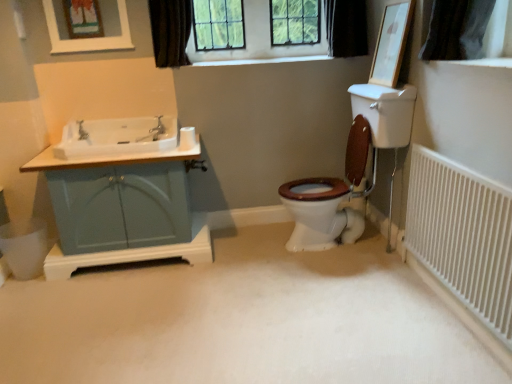
Question: Is clear glass window at upper center at the right side of white matte toilet paper at upper center?

Choices:
 (A) yes
 (B) no

Answer: (A)

Question: Can you confirm if clear glass window at upper center is bigger than white matte toilet paper at upper center?

Choices:
 (A) yes
 (B) no

Answer: (A)

Question: From the image's perspective, is clear glass window at upper center under white matte toilet paper at upper center?

Choices:
 (A) no
 (B) yes

Answer: (A)

Question: Can you confirm if clear glass window at upper center is wider than white matte toilet paper at upper center?

Choices:
 (A) yes
 (B) no

Answer: (A)

Question: From a real-world perspective, is clear glass window at upper center beneath white matte toilet paper at upper center?

Choices:
 (A) yes
 (B) no

Answer: (B)

Question: Does clear glass window at upper center appear on the left side of white matte toilet paper at upper center?

Choices:
 (A) no
 (B) yes

Answer: (A)

Question: Is the depth of white matte carpet at center less than that of wooden picture frame at upper right, which ranks as the first picture frame in right-to-left order?

Choices:
 (A) yes
 (B) no

Answer: (A)

Question: Does white matte carpet at center have a lesser width compared to wooden picture frame at upper right, which ranks as the first picture frame in right-to-left order?

Choices:
 (A) no
 (B) yes

Answer: (A)

Question: Is white matte carpet at center at the right side of wooden picture frame at upper right, which ranks as the first picture frame in right-to-left order?

Choices:
 (A) no
 (B) yes

Answer: (A)

Question: Is white matte carpet at center further to the viewer compared to wooden picture frame at upper right, which is counted as the second picture frame, starting from the left?

Choices:
 (A) no
 (B) yes

Answer: (A)

Question: Can you see white matte carpet at center touching wooden picture frame at upper right, which ranks as the first picture frame in right-to-left order?

Choices:
 (A) yes
 (B) no

Answer: (B)

Question: Is white matte carpet at center wider than wooden picture frame at upper right, which ranks as the first picture frame in right-to-left order?

Choices:
 (A) yes
 (B) no

Answer: (A)

Question: From the image's perspective, is brushed metal faucet at left over black fabric curtain at upper center, the 2th curtain in the left-to-right sequence?

Choices:
 (A) yes
 (B) no

Answer: (B)